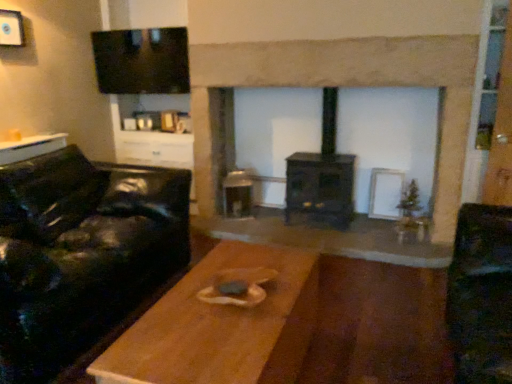
Question: Are wooden table at center, placed as the 2th table when sorted from back to front, and wooden table at left, which is the second table in right-to-left order, far apart?

Choices:
 (A) no
 (B) yes

Answer: (B)

Question: Is wooden table at center, which is the second table from top to bottom, shorter than wooden table at left, the 1th table positioned from the top?

Choices:
 (A) no
 (B) yes

Answer: (A)

Question: From a real-world perspective, does wooden table at center, which is the first table from right to left, stand above wooden table at left, the 1th table positioned from the top?

Choices:
 (A) no
 (B) yes

Answer: (A)

Question: From the image's perspective, is wooden table at center, the 2th table viewed from the left, below wooden table at left, the second table positioned from the front?

Choices:
 (A) no
 (B) yes

Answer: (B)

Question: Is wooden table at center, which is the first table from right to left, at the right side of wooden table at left, which appears as the second table when ordered from the bottom?

Choices:
 (A) yes
 (B) no

Answer: (A)

Question: From their relative heights in the image, would you say wooden table at left, which is the second table in right-to-left order, is taller or shorter than black matte wood burning stove at center?

Choices:
 (A) tall
 (B) short

Answer: (B)

Question: From a real-world perspective, is wooden table at left, which is the first table from back to front, positioned above or below black matte wood burning stove at center?

Choices:
 (A) below
 (B) above

Answer: (B)

Question: Considering their positions, is wooden table at left, the second table positioned from the front, located in front of or behind black matte wood burning stove at center?

Choices:
 (A) behind
 (B) front

Answer: (B)

Question: From the image's perspective, is wooden table at left, acting as the first table starting from the left, positioned above or below black matte wood burning stove at center?

Choices:
 (A) below
 (B) above

Answer: (B)

Question: Looking at their shapes, would you say black matte wood burning stove at center is wider or thinner than white matte picture frame at upper left?

Choices:
 (A) thin
 (B) wide

Answer: (B)

Question: In terms of height, does black matte wood burning stove at center look taller or shorter compared to white matte picture frame at upper left?

Choices:
 (A) tall
 (B) short

Answer: (A)

Question: Choose the correct answer: Is black matte wood burning stove at center inside white matte picture frame at upper left or outside it?

Choices:
 (A) inside
 (B) outside

Answer: (B)

Question: Is point (329, 104) closer or farther from the camera than point (17, 11)?

Choices:
 (A) farther
 (B) closer

Answer: (A)

Question: From the image's perspective, is dark wood fireplace at center located above or below black leather couch at left?

Choices:
 (A) below
 (B) above

Answer: (B)

Question: Is dark wood fireplace at center situated inside black leather couch at left or outside?

Choices:
 (A) inside
 (B) outside

Answer: (B)